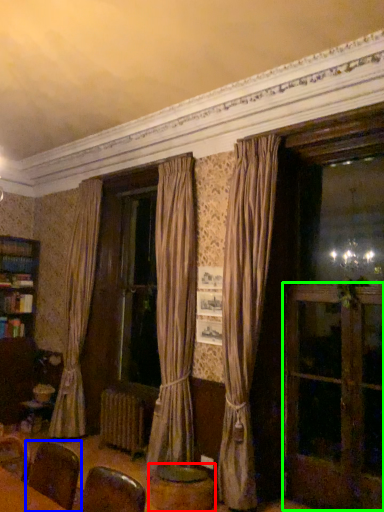
Question: Which object is the closest to the round table (highlighted by a red box)? Choose among these: armchair (highlighted by a blue box) or screen door (highlighted by a green box).

Choices:
 (A) armchair
 (B) screen door

Answer: (B)